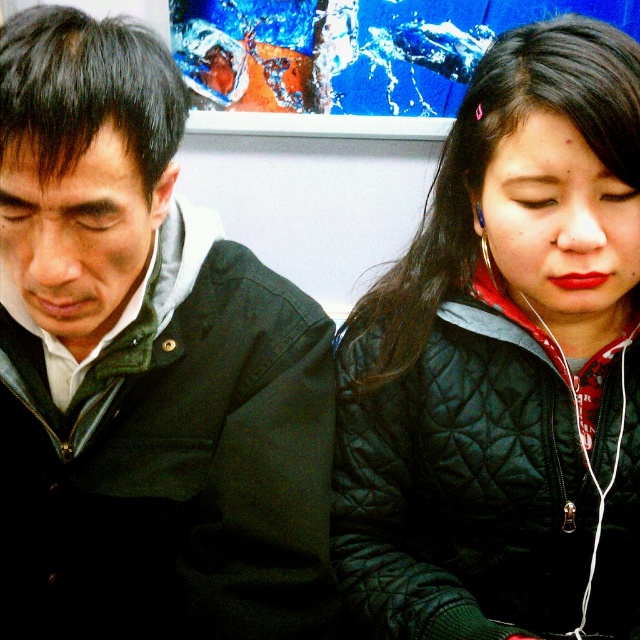
In the scene shown: You are a tailor who needs to determine which jacket requires a taller hanger. Based on the image, which of the two jackets, the matte black jacket at left or the black quilted jacket at center, is taller?

The black quilted jacket at center is taller than the matte black jacket at left, so it requires a taller hanger.

You are a tailor who needs to determine which jacket requires more fabric for alterations. Based on the image, which jacket would need more fabric, the matte black jacket at left or the black quilted jacket at center?

The matte black jacket at left requires more fabric for alterations because it has a larger size compared to the black quilted jacket at center.